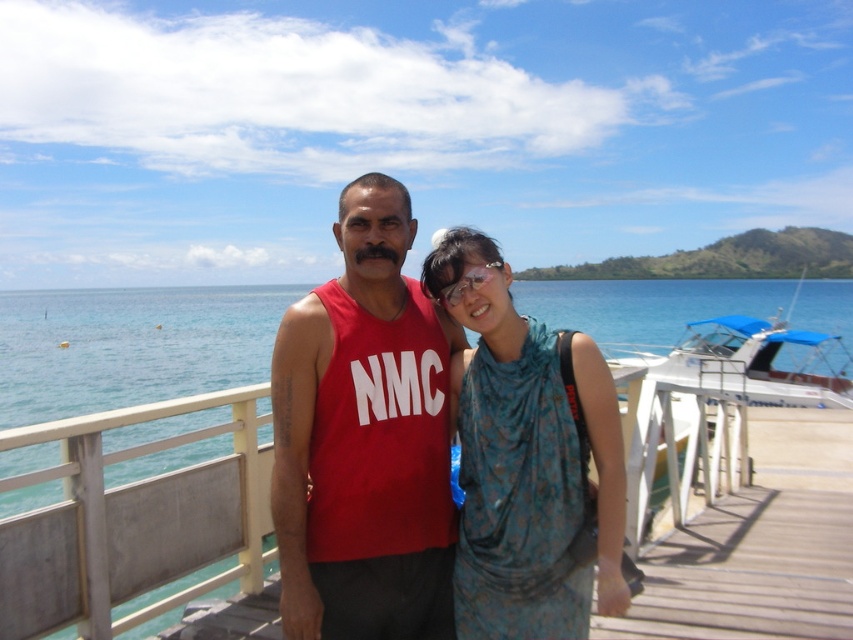
You are a photographer trying to capture a photo of the blue water at center and the blue floral dress at center. Which object should you focus on first if you want to ensure both are in the frame?

The blue water at center is located above the blue floral dress at center, so you should focus on the blue floral dress at center first to ensure both are in the frame.

You are a photographer trying to capture a photo of the two people in the center of the image. You want to ensure that the matte red tank top at center and the blue floral dress at center are both visible in the frame. Based on their positions, which one should you focus on first to ensure they are both in the shot?

The matte red tank top at center is positioned on the left side of blue floral dress at center, so focusing on the blue floral dress at center first would ensure both are in the frame as the red tank top is to the left of it.